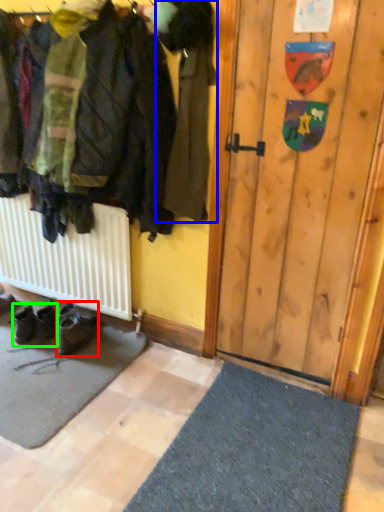
Question: Which object is the farthest from footwear (highlighted by a red box)? Choose among these: jacket (highlighted by a blue box) or footwear (highlighted by a green box).

Choices:
 (A) jacket
 (B) footwear

Answer: (A)